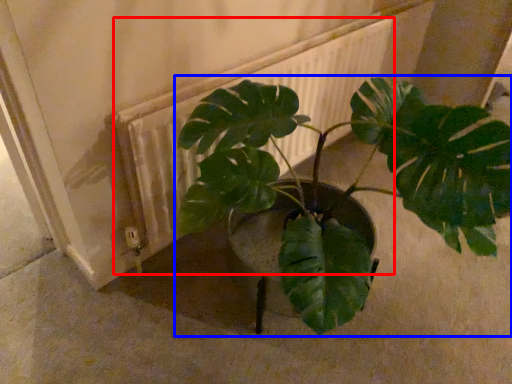
Question: Which object appears farthest to the camera in this image, radiator (highlighted by a red box) or houseplant (highlighted by a blue box)?

Choices:
 (A) radiator
 (B) houseplant

Answer: (A)